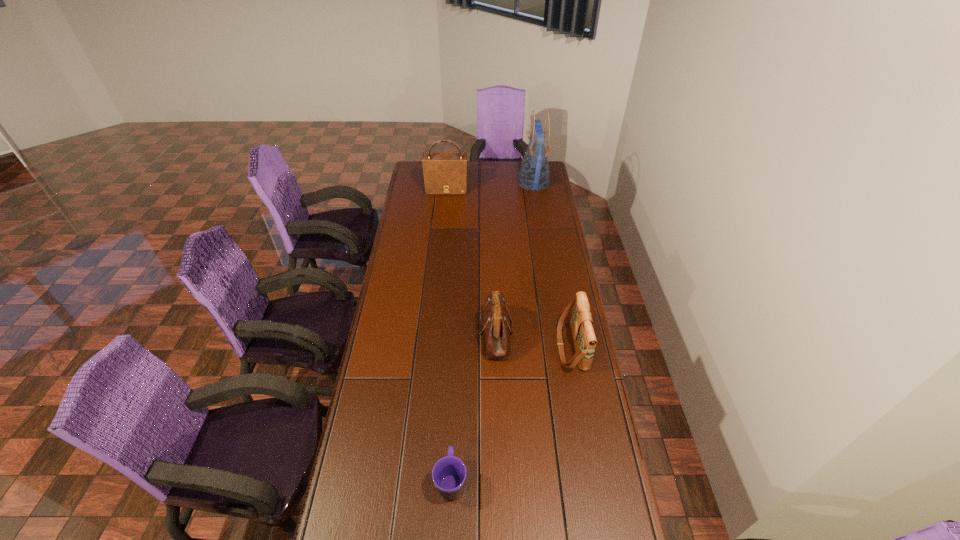
At what (x,y) coordinates should I click in order to perform the action: click on shoulder bag situated at the right edge. Please return your answer as a coordinate pair (x, y). The image size is (960, 540). Looking at the image, I should click on (581, 322).

Locate an element on the screen. This screenshot has width=960, height=540. object that is at the far left corner is located at coordinates (444, 173).

This screenshot has height=540, width=960. In order to click on object located in the far right corner section of the desktop in this screenshot , I will do `click(534, 174)`.

At what (x,y) coordinates should I click in order to perform the action: click on free spot at the far edge of the desktop. Please return your answer as a coordinate pair (x, y). Looking at the image, I should click on (497, 166).

Where is `free space at the left edge`? The width and height of the screenshot is (960, 540). free space at the left edge is located at coordinates (348, 455).

Find the location of `vacant space at the right edge of the desktop`. vacant space at the right edge of the desktop is located at coordinates (532, 197).

At what (x,y) coordinates should I click in order to perform the action: click on empty space that is in between the mug and the tallest shoulder bag. Please return your answer as a coordinate pair (x, y). Image resolution: width=960 pixels, height=540 pixels. Looking at the image, I should click on (449, 335).

Locate an element on the screen. unoccupied area between the tallest shoulder bag and the mug is located at coordinates pos(449,335).

Where is `free spot between the tallest object and the rightmost shoulder bag`? free spot between the tallest object and the rightmost shoulder bag is located at coordinates (553, 265).

At what (x,y) coordinates should I click in order to perform the action: click on unoccupied area between the rightmost shoulder bag and the second shoulder bag from right to left. Please return your answer as a coordinate pair (x, y). The width and height of the screenshot is (960, 540). Looking at the image, I should click on (534, 340).